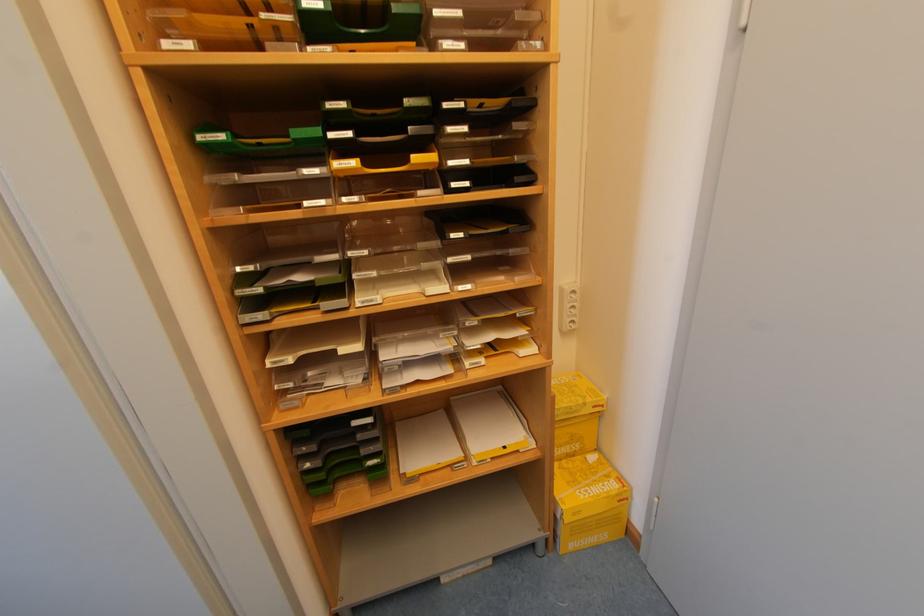
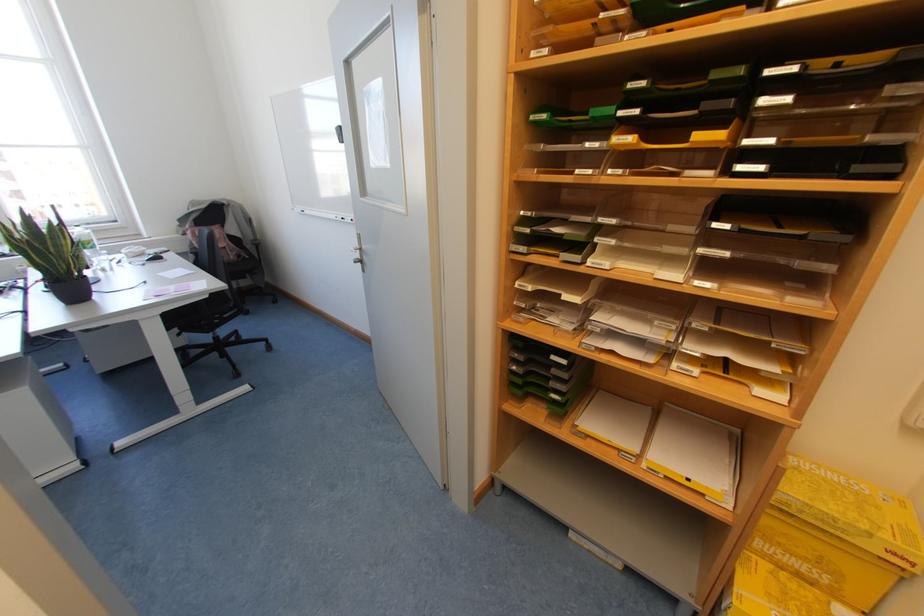
The point at (228, 132) is marked in the first image. Where is the corresponding point in the second image?

(550, 111)